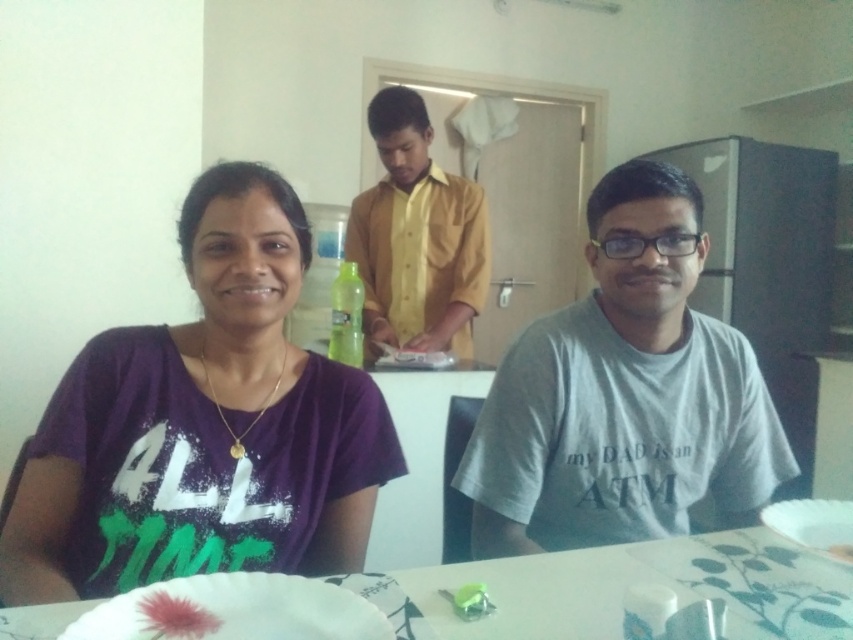
Question: Which of the following is the farthest from the observer?

Choices:
 (A) purple cotton t-shirt at left
 (B) white ceramic plate at lower right

Answer: (B)

Question: Which of the following is the farthest from the observer?

Choices:
 (A) (397, 273)
 (B) (164, 502)

Answer: (A)

Question: Which point is closer to the camera?

Choices:
 (A) white printed table at center
 (B) purple cotton t-shirt at left
 (C) white ceramic plate at lower right

Answer: (A)

Question: Where is yellow matte shirt at center located in relation to white ceramic plate at lower right in the image?

Choices:
 (A) below
 (B) above

Answer: (B)

Question: Does gray cotton t-shirt at center have a larger size compared to white ceramic plate at lower right?

Choices:
 (A) yes
 (B) no

Answer: (A)

Question: Where is white printed table at center located in relation to yellow matte shirt at center in the image?

Choices:
 (A) below
 (B) above

Answer: (A)